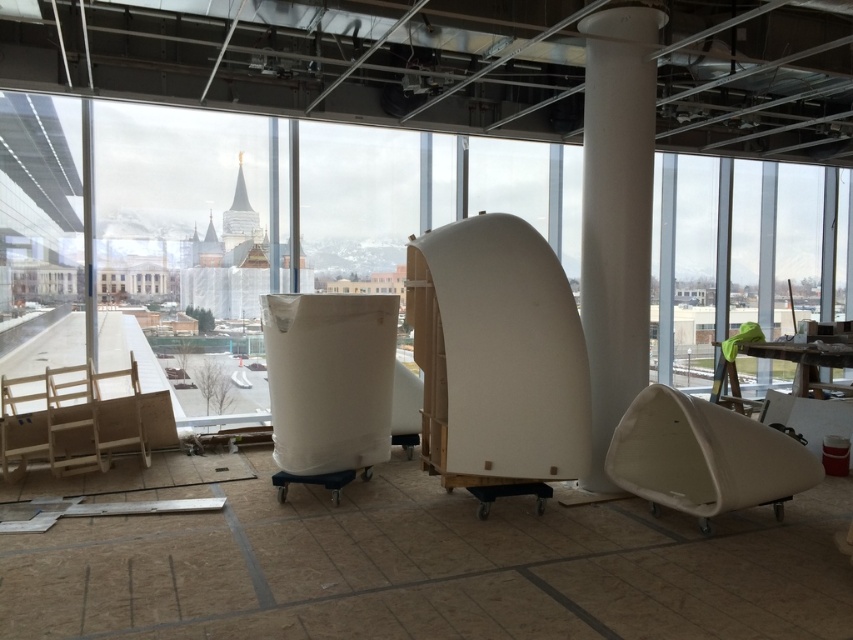
Question: Is white matte chair at lower right positioned before wooden at left?

Choices:
 (A) yes
 (B) no

Answer: (A)

Question: Can you confirm if white smooth column at center is thinner than white matte chair at lower right?

Choices:
 (A) no
 (B) yes

Answer: (B)

Question: Does wooden at left come behind wooden chair at lower left?

Choices:
 (A) yes
 (B) no

Answer: (A)

Question: Which of the following is the closest to the observer?

Choices:
 (A) (45, 381)
 (B) (91, 454)
 (C) (799, 490)
 (D) (123, 410)

Answer: (C)

Question: Which point is farther to the camera?

Choices:
 (A) white matte chair at lower right
 (B) wooden chair at lower left

Answer: (B)

Question: Which of these objects is positioned farthest from the wooden chair at lower left?

Choices:
 (A) white smooth column at center
 (B) wooden at left
 (C) white matte chair at lower right
 (D) wooden chair at left

Answer: (C)